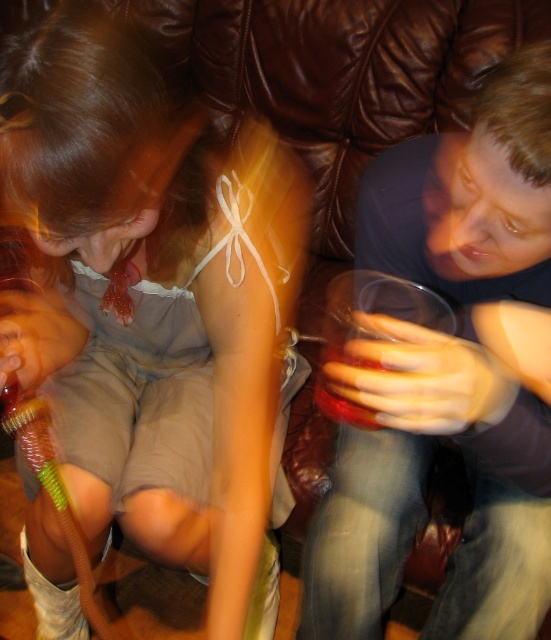
Does matte plastic cup at right lie in front of translucent plastic cup at lower center?

Yes, matte plastic cup at right is closer to the viewer.

How far apart are matte plastic cup at right and translucent plastic cup at lower center?

The distance of matte plastic cup at right from translucent plastic cup at lower center is 7.57 inches.

This screenshot has height=640, width=551. In order to click on matte plastic cup at right in this screenshot , I will do `click(424, 492)`.

Based on the photo, is matte white ribbon at upper center to the right of matte plastic cup at right from the viewer's perspective?

No, matte white ribbon at upper center is not to the right of matte plastic cup at right.

Where is `matte white ribbon at upper center`? This screenshot has width=551, height=640. matte white ribbon at upper center is located at coordinates (150, 300).

Image resolution: width=551 pixels, height=640 pixels. What do you see at coordinates (150, 300) in the screenshot?
I see `matte white ribbon at upper center` at bounding box center [150, 300].

What are the coordinates of `matte white ribbon at upper center` in the screenshot? It's located at (150, 300).

What do you see at coordinates (150, 300) in the screenshot?
I see `matte white ribbon at upper center` at bounding box center [150, 300].

Is matte white ribbon at upper center below translucent plastic cup at lower center?

No.

Does point (24, 385) lie behind point (358, 408)?

No.

Image resolution: width=551 pixels, height=640 pixels. In order to click on matte white ribbon at upper center in this screenshot , I will do `click(150, 300)`.